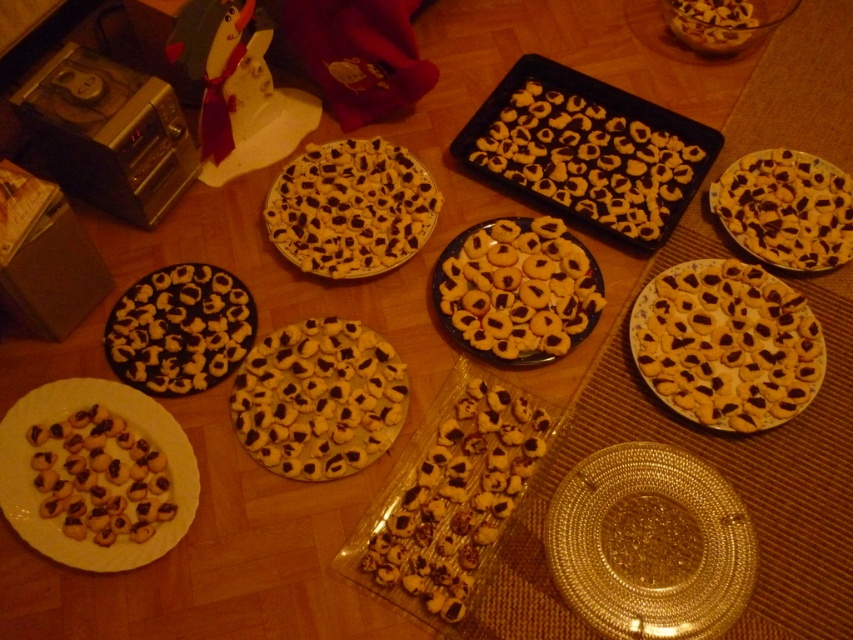
Does matte black cookies at center appear over yellow matte cookies at center?

Indeed, matte black cookies at center is positioned over yellow matte cookies at center.

Between matte black cookies at center and yellow matte cookies at center, which one appears on the right side from the viewer's perspective?

Positioned to the right is matte black cookies at center.

The image size is (853, 640). I want to click on matte black cookies at center, so click(585, 156).

Who is taller, gold textured platter at lower right or yellow matte cookies at center?

yellow matte cookies at center is taller.

Can you confirm if gold textured platter at lower right is positioned to the right of yellow matte cookies at center?

Correct, you'll find gold textured platter at lower right to the right of yellow matte cookies at center.

Is point (613, 616) in front of point (350, 168)?

Yes, it is.

You are a GUI agent. You are given a task and a screenshot of the screen. Output one action in this format:
    pyautogui.click(x=<x>, y=<y>)
    Task: Click on the gold textured platter at lower right
    The width and height of the screenshot is (853, 640).
    Given the screenshot: What is the action you would take?
    pyautogui.click(x=650, y=544)

Between point (726, 522) and point (553, 264), which one is positioned in front?

Point (726, 522) is more forward.

Who is lower down, gold textured platter at lower right or golden brown cookie at center?

gold textured platter at lower right is lower down.

What do you see at coordinates (650, 544) in the screenshot?
I see `gold textured platter at lower right` at bounding box center [650, 544].

Find the location of `gold textured platter at lower right`. gold textured platter at lower right is located at coordinates (650, 544).